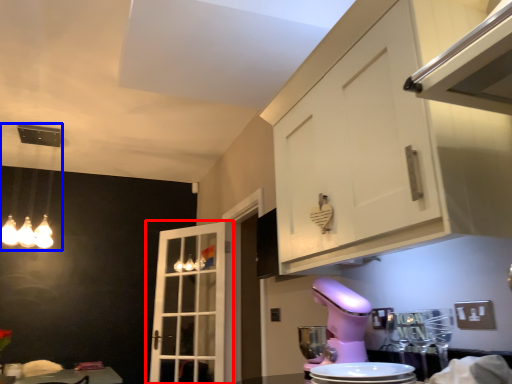
Question: Which of the following is the closest to the observer, door (highlighted by a red box) or light fixture (highlighted by a blue box)?

Choices:
 (A) door
 (B) light fixture

Answer: (B)